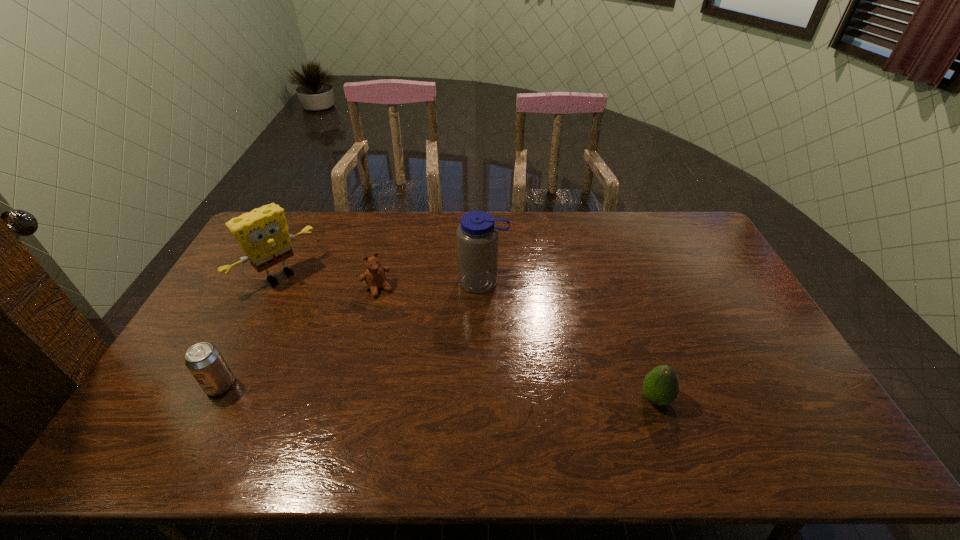
This screenshot has height=540, width=960. I want to click on beer can, so click(x=205, y=362).

Where is `the rightmost object`? The image size is (960, 540). the rightmost object is located at coordinates click(x=660, y=386).

Identify the location of water bottle. Image resolution: width=960 pixels, height=540 pixels. (477, 236).

Find the location of a particular element. The width and height of the screenshot is (960, 540). teddy bear is located at coordinates pyautogui.click(x=374, y=276).

You are a GUI agent. You are given a task and a screenshot of the screen. Output one action in this format:
    pyautogui.click(x=<x>, y=<y>)
    Task: Click on the sponge
    Image resolution: width=960 pixels, height=540 pixels.
    Given the screenshot: What is the action you would take?
    pyautogui.click(x=262, y=234)

Find the location of a particular element. The width and height of the screenshot is (960, 540). free point located on the back of the beer can is located at coordinates (237, 353).

I want to click on vacant space located 0.160m on the back of the avocado, so click(x=635, y=338).

Find the location of a particular element. free location located with a carrying loop on the side of the water bottle is located at coordinates (468, 330).

Where is `free space located 0.080m with a carrying loop on the side of the water bottle`? This screenshot has height=540, width=960. free space located 0.080m with a carrying loop on the side of the water bottle is located at coordinates (473, 313).

At what (x,y) coordinates should I click in order to perform the action: click on vacant space situated 0.240m with a carrying loop on the side of the water bottle. Please return your answer as a coordinate pair (x, y). Looking at the image, I should click on (462, 354).